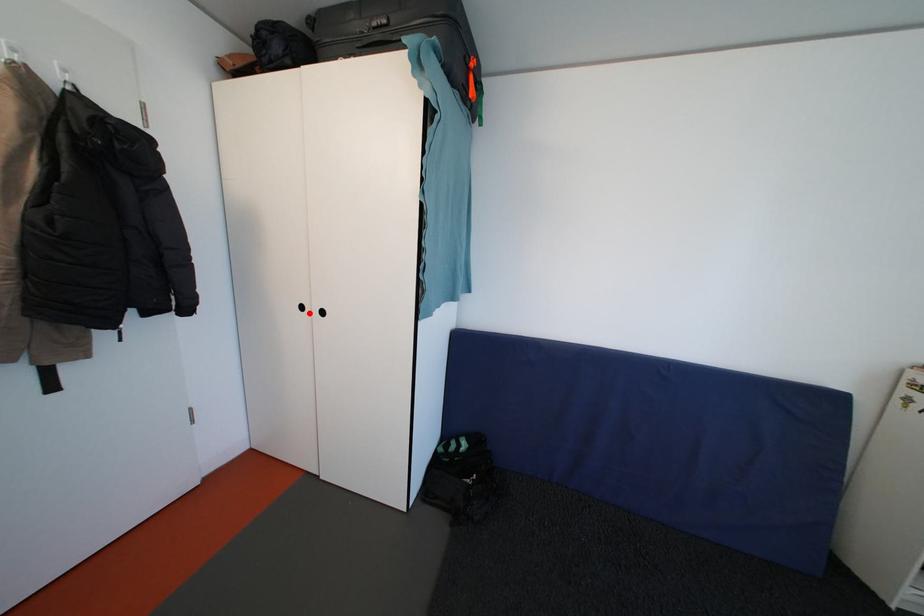
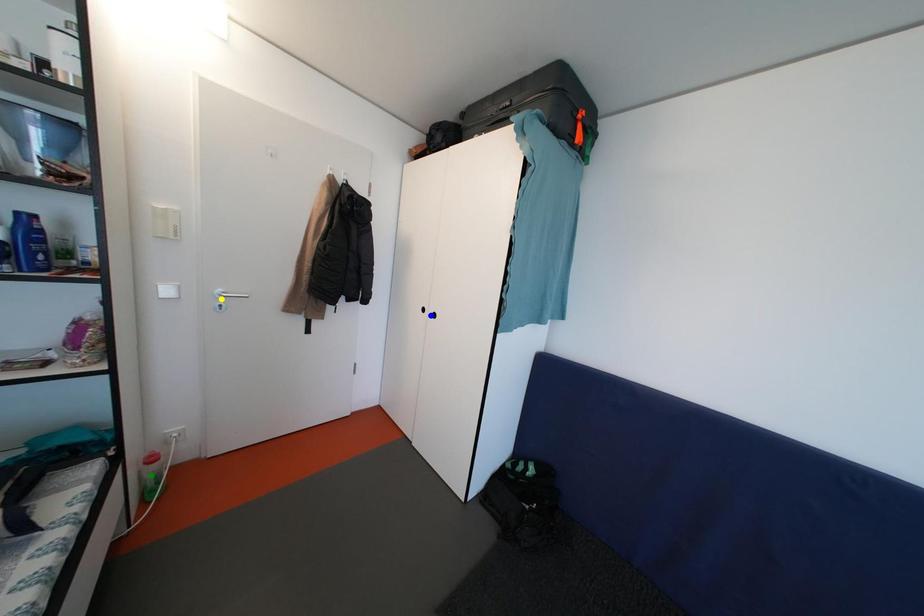
Question: I am providing you with two images of the same scene from different viewpoints. A red point is marked on the first image. You are given multiple points on the second image. Which spot in image 2 lines up with the point in image 1?

Choices:
 (A) yellow point
 (B) green point
 (C) blue point

Answer: (C)